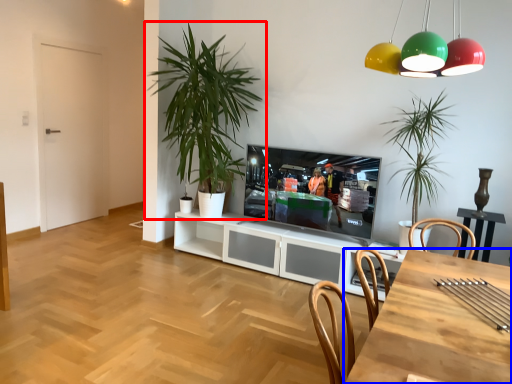
Question: Which point is further to the camera, houseplant (highlighted by a red box) or desk (highlighted by a blue box)?

Choices:
 (A) houseplant
 (B) desk

Answer: (A)